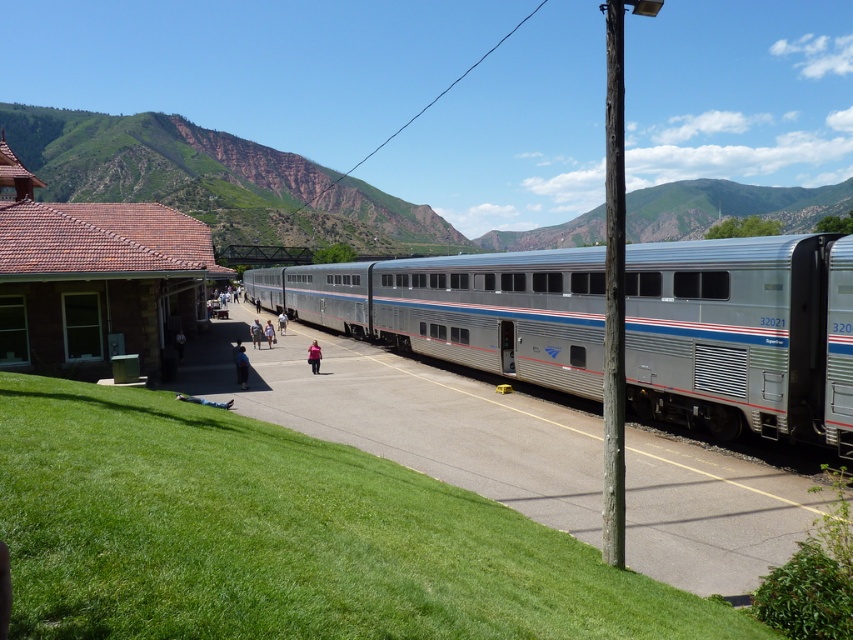
Can you confirm if silver/aluminum train car at center is bigger than green grassy hillside at upper left?

No.

Who is more distant from viewer, (x=848, y=362) or (x=354, y=179)?

The point (x=354, y=179) is more distant.

Where is `silver/aluminum train car at center`? silver/aluminum train car at center is located at coordinates (743, 336).

At what (x,y) coordinates should I click in order to perform the action: click on silver/aluminum train car at center. Please return your answer as a coordinate pair (x, y). Looking at the image, I should click on (743, 336).

Which is behind, point (759, 356) or point (109, 285)?

The point (109, 285) is behind.

Between point (679, 328) and point (155, 301), which one is positioned in front?

Point (679, 328) is in front.

You are a GUI agent. You are given a task and a screenshot of the screen. Output one action in this format:
    pyautogui.click(x=<x>, y=<y>)
    Task: Click on the silver/aluminum train car at center
    Image resolution: width=853 pixels, height=640 pixels.
    Given the screenshot: What is the action you would take?
    pyautogui.click(x=743, y=336)

Is green grassy hillside at upper left positioned before brown stone railway station at left?

No, green grassy hillside at upper left is further to the viewer.

Does green grassy hillside at upper left have a lesser height compared to brown stone railway station at left?

In fact, green grassy hillside at upper left may be taller than brown stone railway station at left.

Which is in front, point (215, 168) or point (33, 256)?

Point (33, 256) is more forward.

I want to click on green grassy hillside at upper left, so click(x=216, y=180).